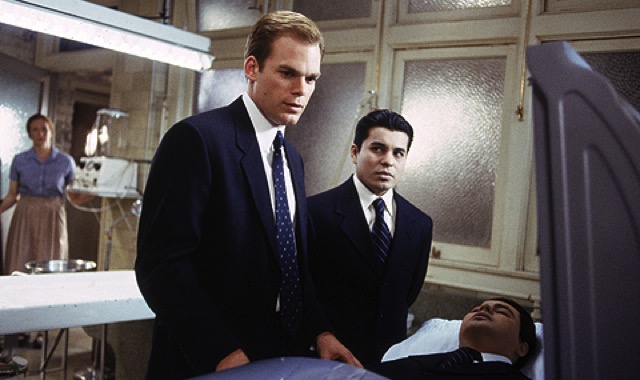
The image size is (640, 380). Find the location of `frosted window`. frosted window is located at coordinates (444, 128), (335, 88), (223, 89), (227, 14), (330, 8), (429, 3), (614, 62).